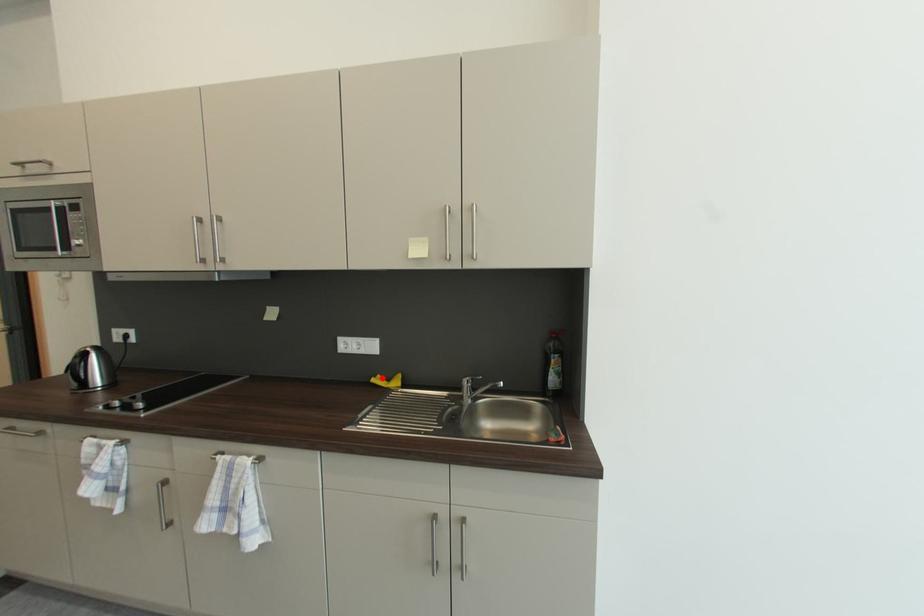
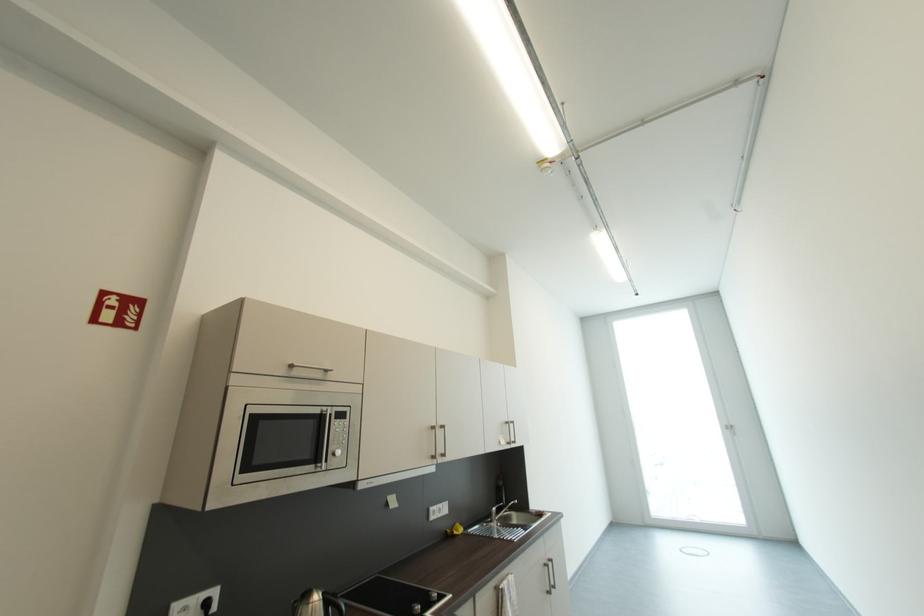
Find the pixel in the second image that matches the highlighted location in the first image.

(454, 533)